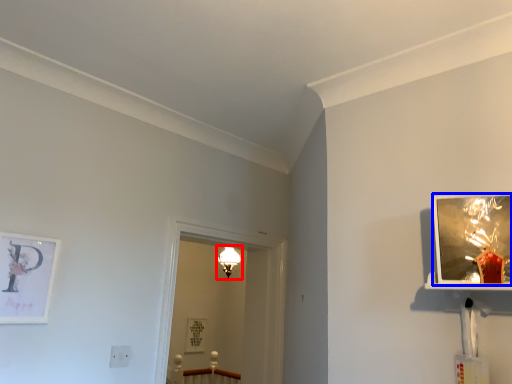
Question: Which object appears closest to the camera in this image, light fixture (highlighted by a red box) or picture frame (highlighted by a blue box)?

Choices:
 (A) light fixture
 (B) picture frame

Answer: (B)